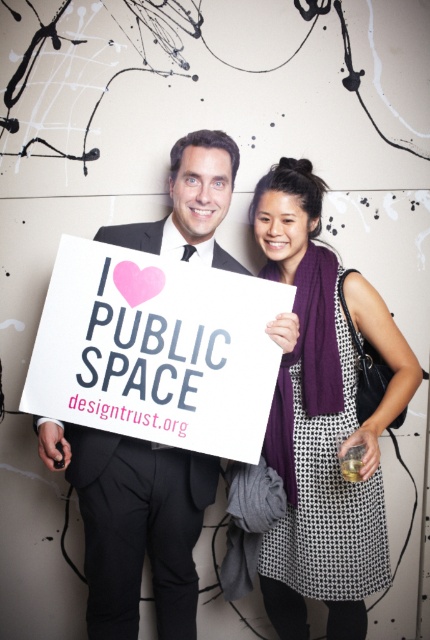
You are an interior designer who wants to place a new painting on the wall between the man on the left and the woman on the right. The coordinates for the center of the painting should be at point (322, 419). According to the image, what object is currently located at that position?

The point (322, 419) indicates the location of the purple knitted scarf at upper right.

You are organizing a photoshoot and need to ensure that all items in the frame are visible. Given that the purple knitted scarf at upper right and the black matte suit at center are both in the shot, which item has a greater width?

The purple knitted scarf at upper right has a greater width than the black matte suit at center according to the description provided.

Consider the image. You are an event planner organizing a photoshoot and need to ensure that the white paper sign at center and the black matte suit at center are both visible in the frame. Given their sizes, which object might require more strategic placement to ensure visibility?

The white paper sign at center occupies less space than the black matte suit at center, so the white paper sign at center might require more strategic placement to ensure visibility since it is smaller and could be easily overshadowed by the larger object.